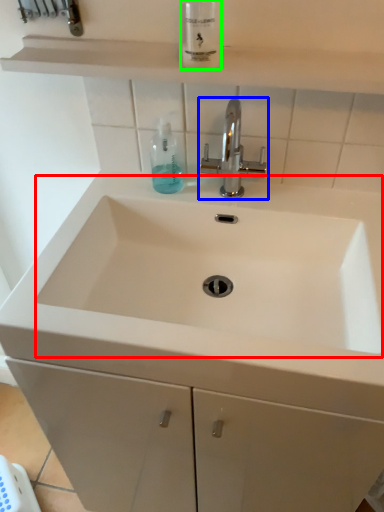
Question: Which is farther away from sink (highlighted by a red box)? tap (highlighted by a blue box) or mouthwash (highlighted by a green box)?

Choices:
 (A) tap
 (B) mouthwash

Answer: (B)